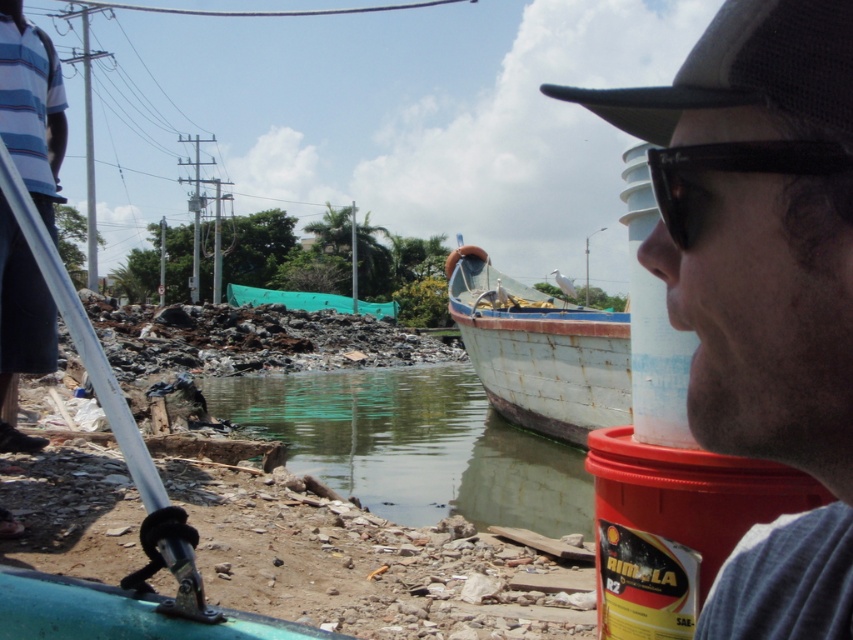
Question: Among these points, which one is farthest from the camera?

Choices:
 (A) (808, 104)
 (B) (834, 568)
 (C) (287, 394)

Answer: (C)

Question: Based on their relative distances, which object is farther from the black ray-ban sunglasses at upper right?

Choices:
 (A) matte black cap at upper right
 (B) green murky water at lower center

Answer: (B)

Question: Can you confirm if black mesh baseball cap at upper right is wider than rusty metal boat at center?

Choices:
 (A) no
 (B) yes

Answer: (A)

Question: Which of the following is the closest to the observer?

Choices:
 (A) (502, 340)
 (B) (421, 497)

Answer: (B)

Question: Does green murky water at lower center appear over black ray-ban sunglasses at upper right?

Choices:
 (A) no
 (B) yes

Answer: (A)

Question: Does rusty metal boat at center have a greater width compared to black ray-ban sunglasses at upper right?

Choices:
 (A) no
 (B) yes

Answer: (B)